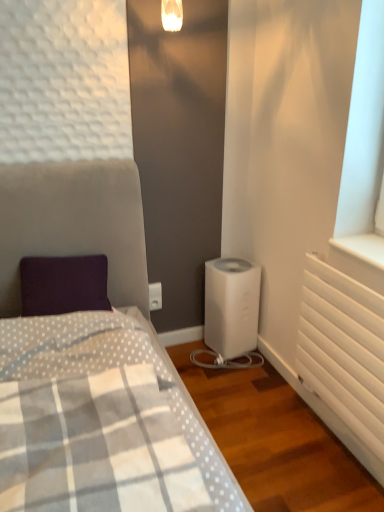
Image resolution: width=384 pixels, height=512 pixels. I want to click on vacant space in front of white plastic water heater at lower center, so click(x=235, y=373).